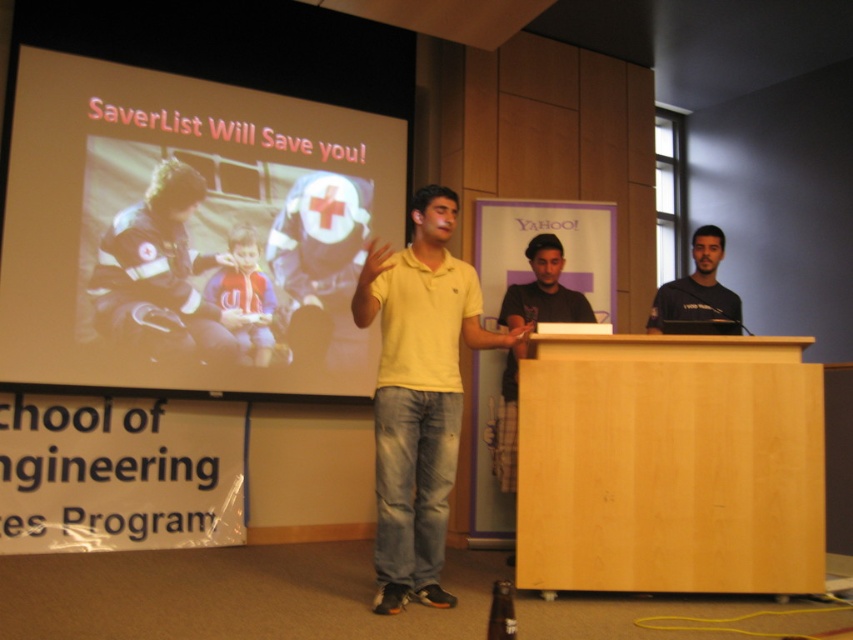
Is the position of yellow cotton shirt at center more distant than that of dark gray t-shirt at center?

That is False.

Between point (439, 435) and point (665, 308), which one is positioned in front?

Point (439, 435) is in front.

Find the location of a particular element. The image size is (853, 640). yellow cotton shirt at center is located at coordinates (418, 394).

Does yellow cotton shirt at center come behind dark blue uniform at center?

That is False.

Looking at this image, is yellow cotton shirt at center smaller than dark blue uniform at center?

Incorrect, yellow cotton shirt at center is not smaller in size than dark blue uniform at center.

Is point (436, 593) farther from camera compared to point (186, 177)?

No.

I want to click on yellow cotton shirt at center, so click(x=418, y=394).

Which is more to the right, light brown wood podium at center or dark blue uniform at center?

light brown wood podium at center is more to the right.

Does light brown wood podium at center have a smaller size compared to dark blue uniform at center?

Indeed, light brown wood podium at center has a smaller size compared to dark blue uniform at center.

Locate an element on the screen. This screenshot has height=640, width=853. light brown wood podium at center is located at coordinates (670, 465).